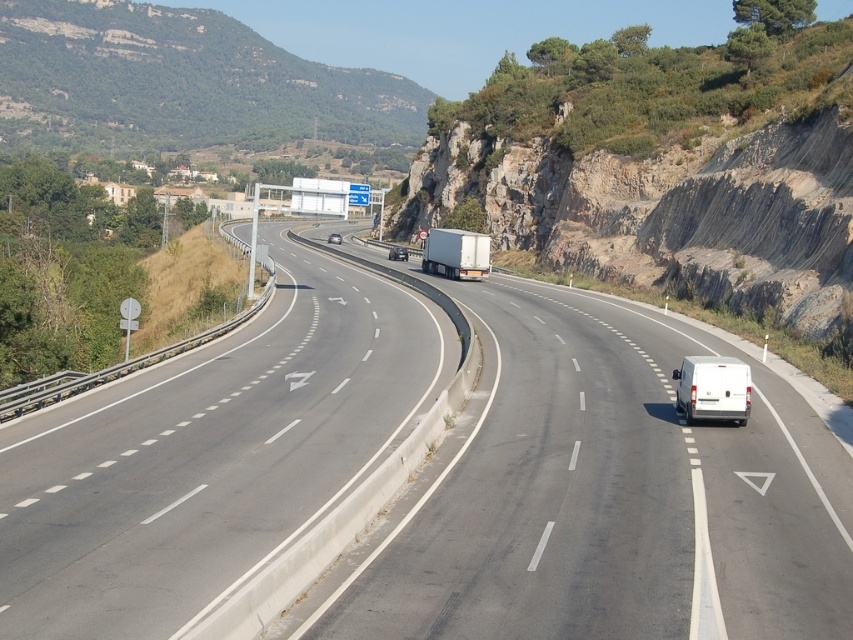
You are standing at the edge of the highway near the guardrail and want to reach a specific point marked at coordinates point (698, 356). Considering the distance, can you walk there without crossing the road?

The point (698, 356) is 70.70 feet away from the viewer. Since the highway has multiple lanes and the point is likely on the opposite side, you would need to cross the road, which is unsafe. Therefore, you cannot walk there without crossing the road.